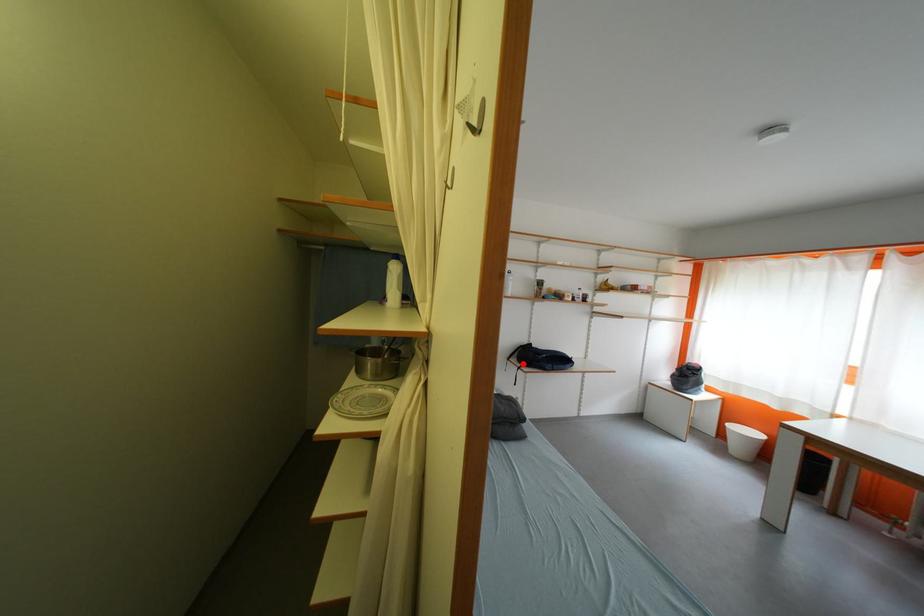
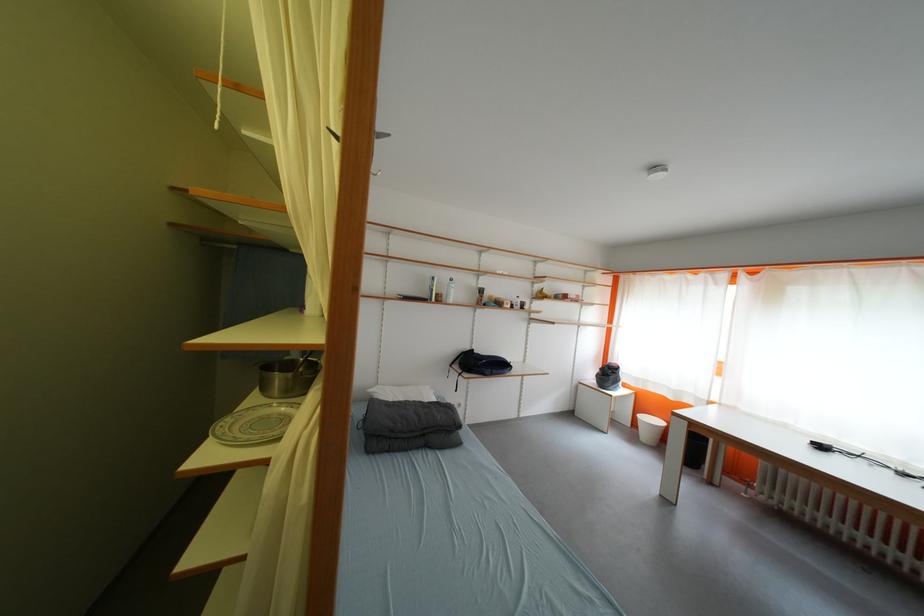
Where in the second image is the point corresponding to the highlighted location from the first image?

(466, 370)